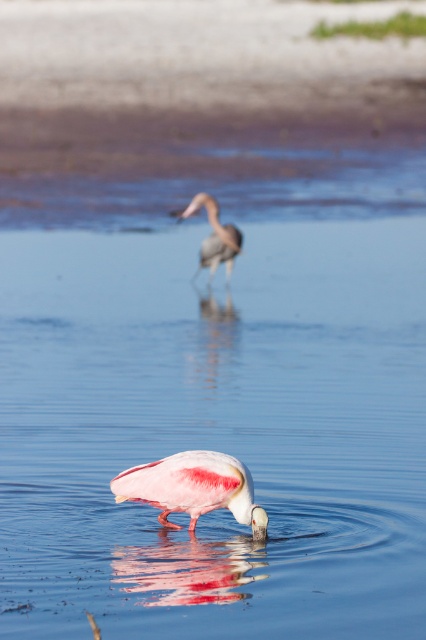
Between point (236, 481) and point (212, 218), which one is positioned in front?

Point (236, 481) is in front.

Is pink feathered spoonbill at lower center taller than gray matte heron at center?

No.

This screenshot has width=426, height=640. Identify the location of pink feathered spoonbill at lower center. (193, 486).